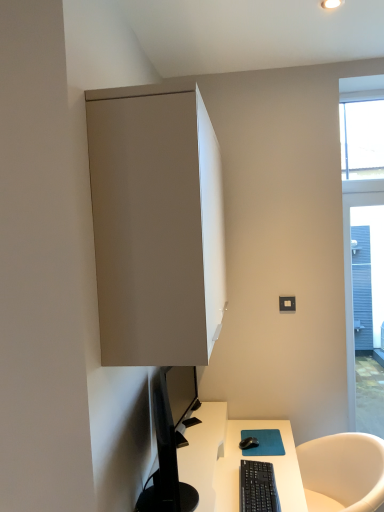
Locate an element on the screen. vacant area that lies to the right of black matte mouse at lower center is located at coordinates (275, 442).